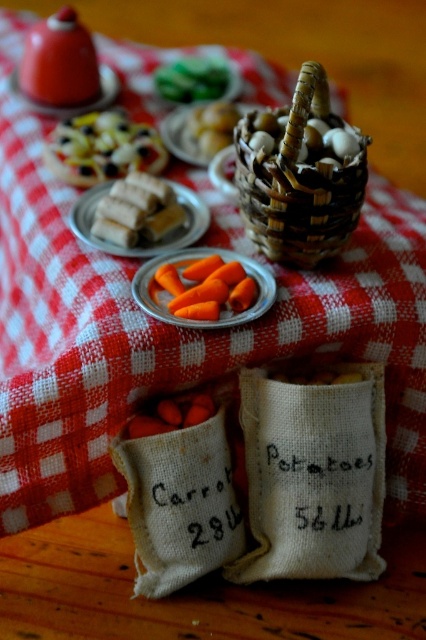
Does smooth brown basket at upper center have a smaller size compared to orange matte carrot at center?

Incorrect, smooth brown basket at upper center is not smaller in size than orange matte carrot at center.

Which is above, smooth brown basket at upper center or orange matte carrot at center?

smooth brown basket at upper center is higher up.

Is point (314, 157) more distant than point (244, 300)?

That is True.

The width and height of the screenshot is (426, 640). I want to click on smooth brown basket at upper center, so click(328, 141).

Is brown woven basket at center to the left of orange matte carrot at center from the viewer's perspective?

Incorrect, brown woven basket at center is not on the left side of orange matte carrot at center.

Is brown woven basket at center shorter than orange matte carrot at center?

Incorrect, brown woven basket at center's height does not fall short of orange matte carrot at center's.

Find the location of a particular element. This screenshot has width=426, height=640. brown woven basket at center is located at coordinates (301, 173).

Does smooth white cheese at center have a lesser height compared to orange matte carrot at center?

Incorrect, smooth white cheese at center's height does not fall short of orange matte carrot at center's.

I want to click on smooth white cheese at center, so click(x=213, y=125).

This screenshot has height=640, width=426. I want to click on smooth white cheese at center, so click(213, 125).

At what (x,y) coordinates should I click in order to perform the action: click on smooth white cheese at center. Please return your answer as a coordinate pair (x, y). Looking at the image, I should click on (213, 125).